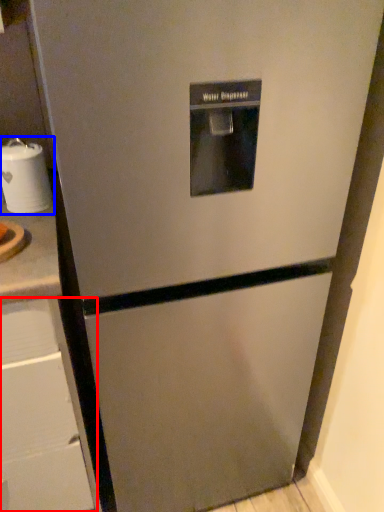
Question: Which object appears closest to the camera in this image, drawer (highlighted by a red box) or appliance (highlighted by a blue box)?

Choices:
 (A) drawer
 (B) appliance

Answer: (A)